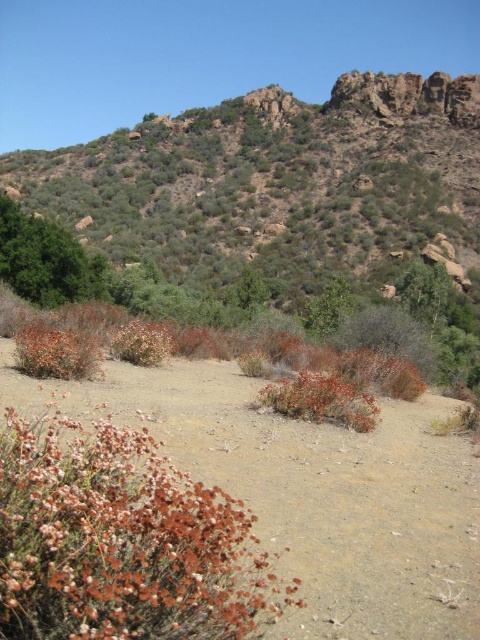
Question: Is dried brown flowers at lower left above dried grass at center?

Choices:
 (A) no
 (B) yes

Answer: (B)

Question: Is dried brown flowers at lower left further to camera compared to dried grass at center?

Choices:
 (A) yes
 (B) no

Answer: (B)

Question: Does dried brown flowers at lower left have a lesser width compared to dried grass at center?

Choices:
 (A) yes
 (B) no

Answer: (B)

Question: Among these objects, which one is nearest to the camera?

Choices:
 (A) dried brown flowers at lower left
 (B) dried grass at center

Answer: (A)

Question: Among these objects, which one is nearest to the camera?

Choices:
 (A) dried brown flowers at lower left
 (B) dried grass at center

Answer: (A)

Question: Which of the following is the closest to the observer?

Choices:
 (A) pos(124,600)
 (B) pos(333,406)

Answer: (A)